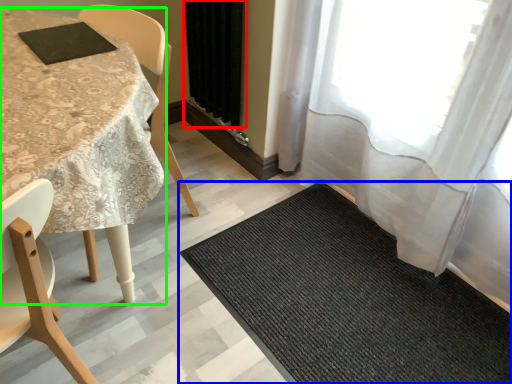
Question: Which object is positioned closest to curtain (highlighted by a red box)? Select from mat (highlighted by a blue box) and table (highlighted by a green box).

Choices:
 (A) mat
 (B) table

Answer: (B)